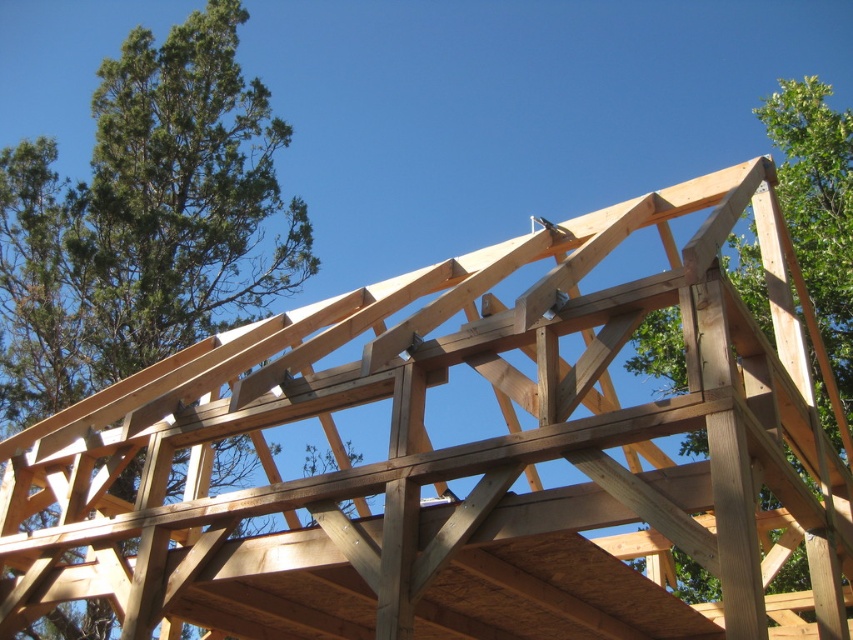
You are an architect looking at the roof framework and notice two trees in the background. Which tree, the green leafy tree at upper left or the natural wood tree at upper right, is taller?

The green leafy tree at upper left is much taller than the natural wood tree at upper right.

You are a contractor assessing the stability of the roof framework. You notice two trees in the background, the green leafy tree at upper left and the natural wood tree at upper right. Which tree has a smaller trunk diameter?

The green leafy tree at upper left has a smaller trunk diameter than the natural wood tree at upper right.